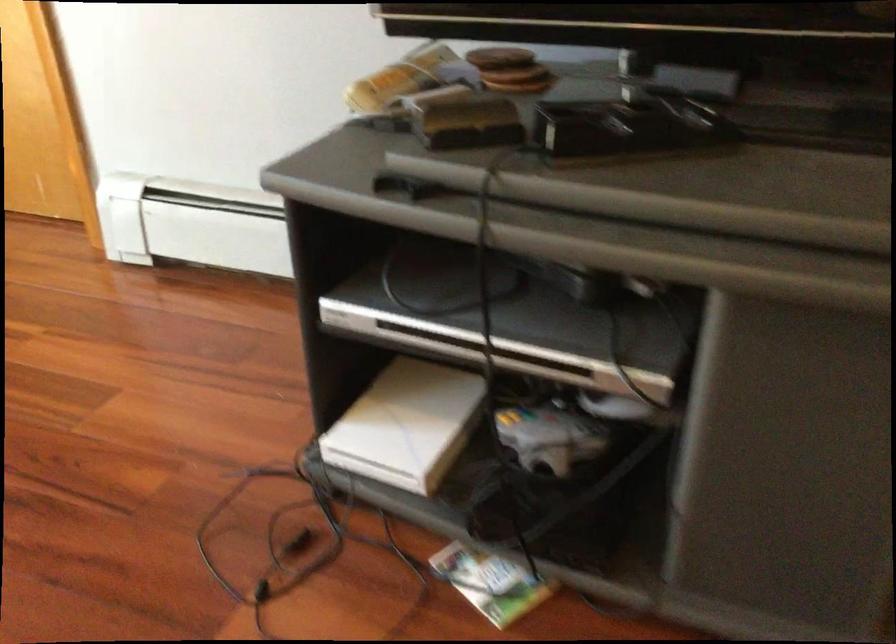
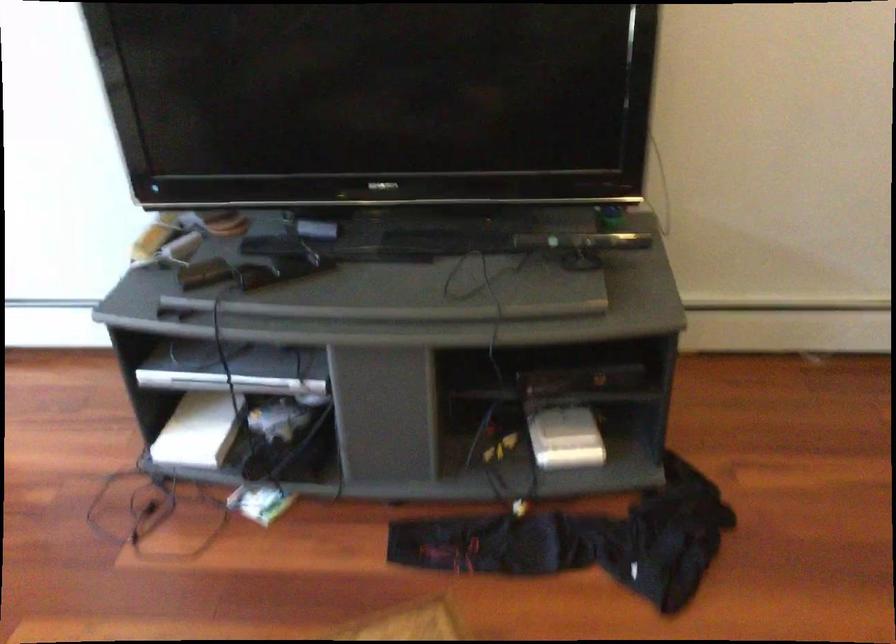
The point at (411, 422) is marked in the first image. Where is the corresponding point in the second image?

(199, 430)